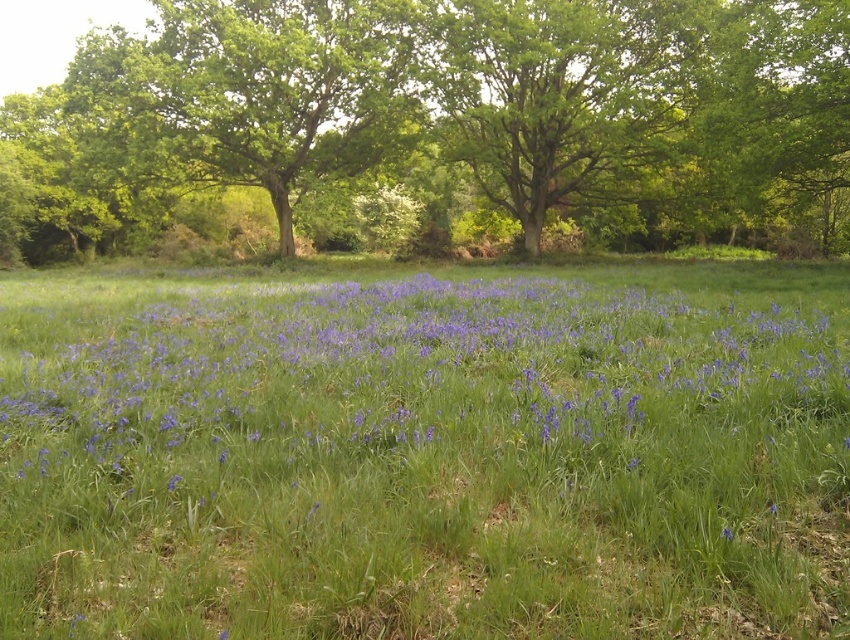
You are standing in the field of bluebells looking towards the trees. There are two points marked in the scene. Which point, point [819,396] or point [728,529], is closer to you?

Point [819,396] is further to the camera than point [728,529]. Therefore, point [728,529] is closer to you.